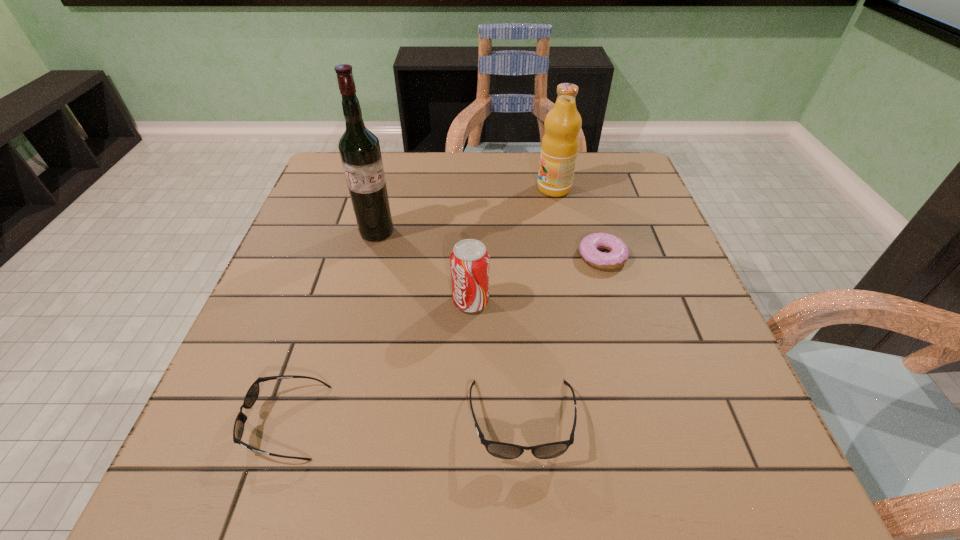
Identify the location of object present at the near left corner. The width and height of the screenshot is (960, 540). (252, 394).

I want to click on free space at the far edge, so click(469, 156).

Locate an element on the screen. This screenshot has width=960, height=540. free space at the near edge of the desktop is located at coordinates (560, 401).

In the image, there is a desktop. Identify the location of vacant space at the left edge. The width and height of the screenshot is (960, 540). (306, 237).

I want to click on vacant space at the right edge of the desktop, so click(612, 207).

The image size is (960, 540). In order to click on vacant area at the far left corner of the desktop in this screenshot , I will do `click(344, 197)`.

Locate an element on the screen. vacant space at the near right corner of the desktop is located at coordinates (740, 393).

Where is `unoccupied area between the fruit juice and the taller sunglasses`? unoccupied area between the fruit juice and the taller sunglasses is located at coordinates coord(539,305).

Locate an element on the screen. The height and width of the screenshot is (540, 960). vacant area that lies between the left sunglasses and the doughnut is located at coordinates (444, 339).

The width and height of the screenshot is (960, 540). I want to click on free spot between the third shortest object and the third nearest object, so click(496, 361).